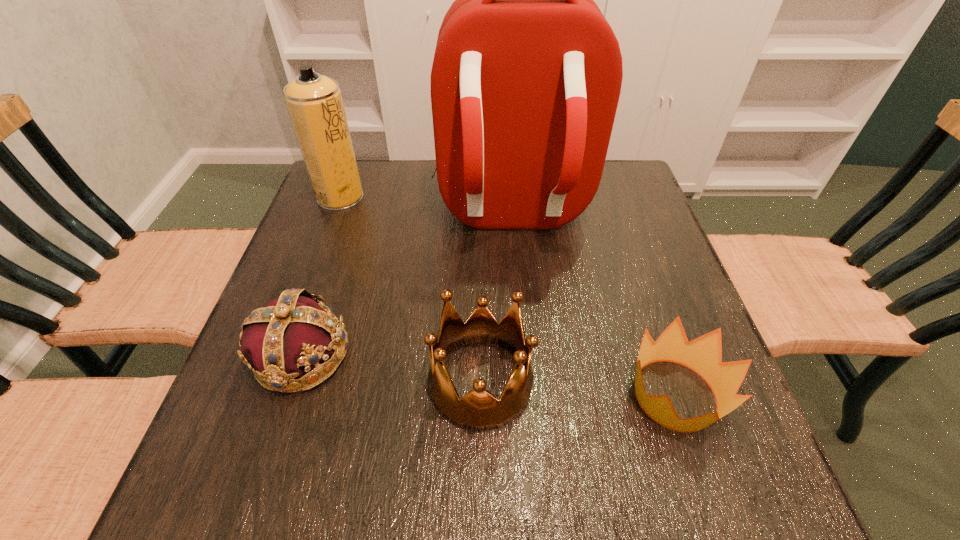
The height and width of the screenshot is (540, 960). Identify the location of free space that satisfies the following two spatial constraints: 1. on the front side of the rightmost crown; 2. on the left side of the third shortest object. (481, 395).

The width and height of the screenshot is (960, 540). Find the location of `free space that satisfies the following two spatial constraints: 1. on the front side of the shortest object; 2. on the left side of the second crown from right to left`. free space that satisfies the following two spatial constraints: 1. on the front side of the shortest object; 2. on the left side of the second crown from right to left is located at coordinates click(481, 395).

This screenshot has width=960, height=540. In order to click on free spot that satisfies the following two spatial constraints: 1. on the front side of the leftmost crown; 2. on the left side of the rightmost crown in this screenshot , I will do `click(288, 395)`.

Where is `vacant area that satisfies the following two spatial constraints: 1. on the strap side of the shortest object; 2. on the right side of the backpack`? The height and width of the screenshot is (540, 960). vacant area that satisfies the following two spatial constraints: 1. on the strap side of the shortest object; 2. on the right side of the backpack is located at coordinates pyautogui.click(x=524, y=395).